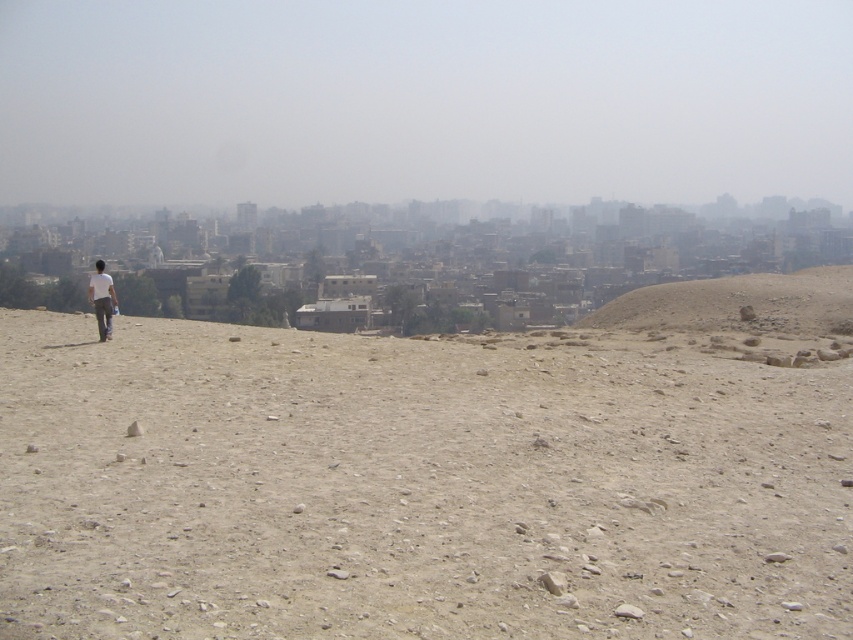
Question: Which of the following is the closest to the observer?

Choices:
 (A) (94, 285)
 (B) (608, 486)
 (C) (799, 298)

Answer: (B)

Question: Does light brown gravel at center appear over white matte shirt at center?

Choices:
 (A) yes
 (B) no

Answer: (B)

Question: Is desert sand hill at right closer to the viewer compared to white matte shirt at center?

Choices:
 (A) yes
 (B) no

Answer: (B)

Question: Is light brown gravel at center thinner than desert sand hill at right?

Choices:
 (A) yes
 (B) no

Answer: (B)

Question: Based on their relative distances, which object is nearer to the white matte shirt at center?

Choices:
 (A) light brown gravel at center
 (B) desert sand hill at right

Answer: (A)

Question: Estimate the real-world distances between objects in this image. Which object is closer to the desert sand hill at right?

Choices:
 (A) light brown gravel at center
 (B) white matte shirt at center

Answer: (A)